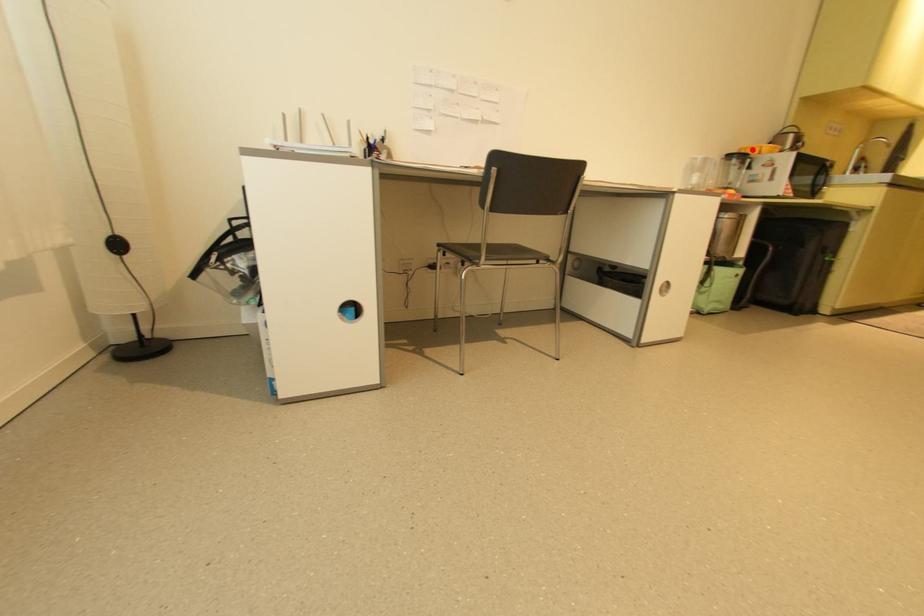
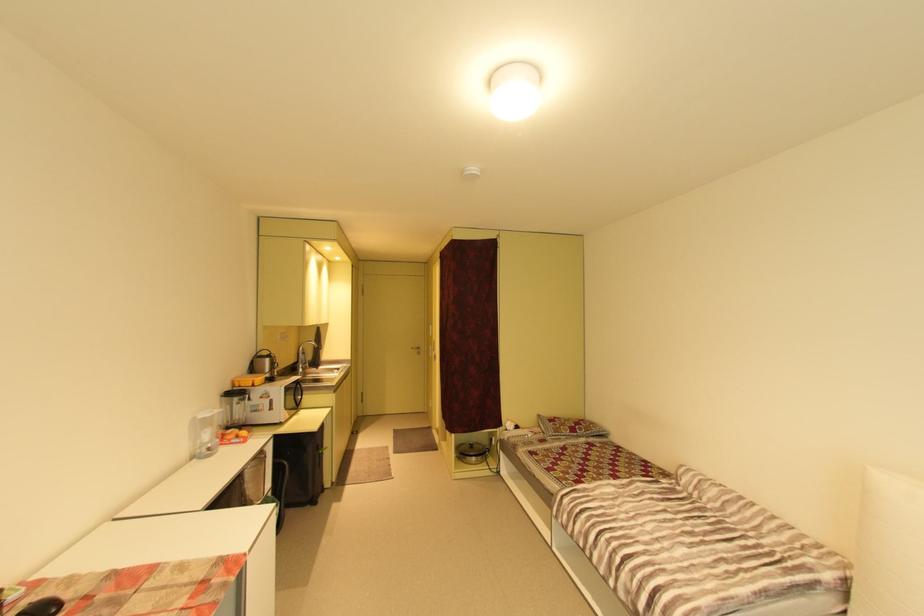
Question: I am providing you with two images of the same scene from different viewpoints. In image1, a red point is highlighted. Considering the same 3D point in image2, which of the following is correct?

Choices:
 (A) It is closer
 (B) It is farther

Answer: (A)